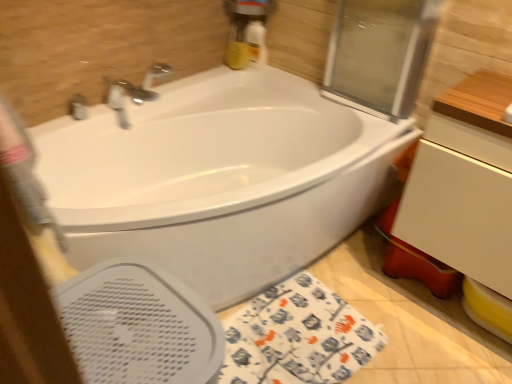
Identify the location of white glossy bathtub at center. (220, 179).

In order to face white glossy bathtub at center, should I rotate leftwards or rightwards?

Turn left approximately 6.039 degrees to face it.

Image resolution: width=512 pixels, height=384 pixels. Describe the element at coordinates (297, 337) in the screenshot. I see `white fabric beach towel at lower center` at that location.

Measure the distance between point [265,359] and camera.

The depth of point [265,359] is 1.54 meters.

In order to face white matte drawer at right, should I rotate leftwards or rightwards?

A 29.548 degree turn to the right will do.

This screenshot has height=384, width=512. What are the coordinates of `transparent glass screen door at upper right` in the screenshot? It's located at (380, 53).

Describe the element at coordinates (138, 326) in the screenshot. This screenshot has width=512, height=384. I see `white perforated bidet at lower left` at that location.

At what (x,y) coordinates should I click in order to perform the action: click on matte silver faucet at upper left. Please return your answer as a coordinate pair (x, y). This screenshot has height=384, width=512. Looking at the image, I should click on (78, 107).

How many degrees apart are the facing directions of white glossy bathtub at center and matte silver faucet at upper left?

The angle between the facing direction of white glossy bathtub at center and the facing direction of matte silver faucet at upper left is 1.02 degrees.

From a real-world perspective, which object rests below the other?

white glossy bathtub at center.

Is white glossy bathtub at center completely or partially outside of matte silver faucet at upper left?

Absolutely, white glossy bathtub at center is external to matte silver faucet at upper left.

Between white glossy bathtub at center and matte silver faucet at upper left, which one appears on the right side from the viewer's perspective?

From the viewer's perspective, white glossy bathtub at center appears more on the right side.

Is point (388, 67) more distant than point (341, 335)?

That is True.

Between transparent glass screen door at upper right and white fabric beach towel at lower center, which one has larger width?

With larger width is white fabric beach towel at lower center.

Visually, is transparent glass screen door at upper right positioned to the left or to the right of white fabric beach towel at lower center?

transparent glass screen door at upper right is positioned on white fabric beach towel at lower center's right side.

Is transparent glass screen door at upper right bigger than white fabric beach towel at lower center?

Yes, transparent glass screen door at upper right is bigger than white fabric beach towel at lower center.

How much distance is there between white glossy bathtub at center and white matte drawer at right?

A distance of 23.19 inches exists between white glossy bathtub at center and white matte drawer at right.

Considering the sizes of objects white glossy bathtub at center and white matte drawer at right in the image provided, who is bigger, white glossy bathtub at center or white matte drawer at right?

With larger size is white glossy bathtub at center.

Would you say white glossy bathtub at center is outside white matte drawer at right?

white glossy bathtub at center is positioned outside white matte drawer at right.

From a real-world perspective, which is physically below, white glossy bathtub at center or white matte drawer at right?

In real-world perspective, white glossy bathtub at center is lower.

Is white matte drawer at right oriented away from white glossy bathtub at center?

No, white matte drawer at right is not facing away from white glossy bathtub at center.

Is white matte drawer at right inside the boundaries of white glossy bathtub at center, or outside?

white matte drawer at right exists outside the volume of white glossy bathtub at center.

Looking at this image, does white matte drawer at right have a lesser height compared to white glossy bathtub at center?

Yes.

Would you say white matte drawer at right is to the left or to the right of white glossy bathtub at center in the picture?

In the image, white matte drawer at right appears on the right side of white glossy bathtub at center.

Would you say white glossy bathtub at center is part of matte silver faucet at upper left's contents?

No.

From the image's perspective, is matte silver faucet at upper left below white glossy bathtub at center?

No, from the image's perspective, matte silver faucet at upper left is not below white glossy bathtub at center.

Which is less distant, (x=390, y=187) or (x=351, y=337)?

The point (x=351, y=337) is in front.

In the scene shown: Is white glossy bathtub at center oriented towards white fabric beach towel at lower center?

Yes, white glossy bathtub at center is turned towards white fabric beach towel at lower center.

Is white glossy bathtub at center bigger than white fabric beach towel at lower center?

Indeed, white glossy bathtub at center has a larger size compared to white fabric beach towel at lower center.

Between white glossy bathtub at center and white fabric beach towel at lower center, which one has more height?

With more height is white glossy bathtub at center.

Would you consider white perforated bidet at lower left to be distant from transparent glass screen door at upper right?

Yes.

Which point is more forward, (179, 363) or (356, 25)?

The point (179, 363) is closer to the camera.

Between white perforated bidet at lower left and transparent glass screen door at upper right, which one has larger width?

Wider between the two is white perforated bidet at lower left.

The width and height of the screenshot is (512, 384). In order to click on plumbing fixture on the left of white glossy bathtub at center in this screenshot , I will do `click(78, 107)`.

Find the location of `screen door above the white fabric beach towel at lower center (from the image's perspective)`. screen door above the white fabric beach towel at lower center (from the image's perspective) is located at coordinates (x=380, y=53).

Considering their positions, is matte silver faucet at upper left positioned closer to white perforated bidet at lower left than white glossy bathtub at center?

white glossy bathtub at center is closer to white perforated bidet at lower left.

Which object lies nearer to the anchor point white glossy bathtub at center, matte silver faucet at upper left or transparent glass screen door at upper right?

transparent glass screen door at upper right is positioned closer to the anchor white glossy bathtub at center.

Which object lies nearer to the anchor point matte silver faucet at upper left, white perforated bidet at lower left or white matte drawer at right?

white perforated bidet at lower left is closer to matte silver faucet at upper left.

When comparing their distances from white matte drawer at right, does white perforated bidet at lower left or transparent glass screen door at upper right seem further?

The object further to white matte drawer at right is white perforated bidet at lower left.

Looking at the image, which one is located further to white matte drawer at right, white glossy bathtub at center or transparent glass screen door at upper right?

white glossy bathtub at center.

From the image, which object appears to be farther from matte silver faucet at upper left, white fabric beach towel at lower center or white glossy bathtub at center?

Based on the image, white fabric beach towel at lower center appears to be further to matte silver faucet at upper left.

Which object lies further to the anchor point transparent glass screen door at upper right, white perforated bidet at lower left or white glossy bathtub at center?

white perforated bidet at lower left.

From the picture: From the image, which object appears to be farther from white fabric beach towel at lower center, white perforated bidet at lower left or white glossy bathtub at center?

Among the two, white perforated bidet at lower left is located further to white fabric beach towel at lower center.

At what (x,y) coordinates should I click in order to perform the action: click on beach towel located between white glossy bathtub at center and white matte drawer at right in the left-right direction. Please return your answer as a coordinate pair (x, y). The width and height of the screenshot is (512, 384). Looking at the image, I should click on (297, 337).

The image size is (512, 384). I want to click on screen door between matte silver faucet at upper left and white matte drawer at right, so click(x=380, y=53).

Where is `screen door located between white perforated bidet at lower left and white matte drawer at right in the left-right direction`? The width and height of the screenshot is (512, 384). screen door located between white perforated bidet at lower left and white matte drawer at right in the left-right direction is located at coordinates (380, 53).

Locate an element on the screen. beach towel situated between white perforated bidet at lower left and white matte drawer at right from left to right is located at coordinates (297, 337).